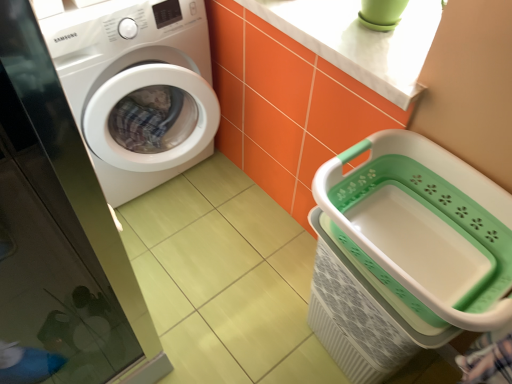
Locate an element on the screen. The height and width of the screenshot is (384, 512). white marble countertop at upper center is located at coordinates (359, 40).

Where is `white plastic laundry basket at lower right`? The width and height of the screenshot is (512, 384). white plastic laundry basket at lower right is located at coordinates (406, 253).

Where is `white marble countertop at upper center`? Image resolution: width=512 pixels, height=384 pixels. white marble countertop at upper center is located at coordinates (359, 40).

Can you confirm if transparent glass screen door at left is shorter than white glossy washing machine at left?

Yes.

How different are the orientations of transparent glass screen door at left and white glossy washing machine at left in degrees?

There is a 0.000107-degree angle between the facing directions of transparent glass screen door at left and white glossy washing machine at left.

How distant is transparent glass screen door at left from white glossy washing machine at left?

transparent glass screen door at left and white glossy washing machine at left are 32.79 centimeters apart.

From a real-world perspective, is transparent glass screen door at left located beneath white glossy washing machine at left?

No, from a real-world perspective, transparent glass screen door at left is not below white glossy washing machine at left.

Would you say transparent glass screen door at left is a long distance from white plastic laundry basket at lower right?

No.

Identify the location of shopping basket to the right of transparent glass screen door at left. (406, 253).

How different are the orientations of transparent glass screen door at left and white plastic laundry basket at lower right in degrees?

transparent glass screen door at left and white plastic laundry basket at lower right are facing 90 degrees away from each other.

Could you tell me if transparent glass screen door at left is turned towards white plastic laundry basket at lower right?

No, transparent glass screen door at left is not turned towards white plastic laundry basket at lower right.

How different are the orientations of transparent glass screen door at left and white marble countertop at upper center in degrees?

transparent glass screen door at left and white marble countertop at upper center are facing 89.1 degrees away from each other.

Is white marble countertop at upper center at the back of transparent glass screen door at left?

That's not correct — transparent glass screen door at left is not looking away from white marble countertop at upper center.

Does point (64, 196) come behind point (414, 90)?

Yes.

Considering the relative sizes of transparent glass screen door at left and white marble countertop at upper center in the image provided, is transparent glass screen door at left thinner than white marble countertop at upper center?

Indeed, transparent glass screen door at left has a lesser width compared to white marble countertop at upper center.

Looking at this image, which object is further away from the camera, white glossy washing machine at left or white plastic laundry basket at lower right?

Positioned behind is white glossy washing machine at left.

Which is nearer, (170, 25) or (333, 159)?

Positioned in front is point (333, 159).

Considering the sizes of objects white glossy washing machine at left and white plastic laundry basket at lower right in the image provided, who is thinner, white glossy washing machine at left or white plastic laundry basket at lower right?

With smaller width is white plastic laundry basket at lower right.

Is white marble countertop at upper center inside the boundaries of white glossy washing machine at left, or outside?

The correct answer is: outside.

Considering the relative sizes of white marble countertop at upper center and white glossy washing machine at left in the image provided, is white marble countertop at upper center thinner than white glossy washing machine at left?

Yes.

Considering their positions, is white marble countertop at upper center located in front of or behind white glossy washing machine at left?

Clearly, white marble countertop at upper center is in front of white glossy washing machine at left.

Considering the sizes of objects white plastic laundry basket at lower right and white glossy washing machine at left in the image provided, who is wider, white plastic laundry basket at lower right or white glossy washing machine at left?

white glossy washing machine at left.

Is white plastic laundry basket at lower right far away from white glossy washing machine at left?

That's not correct — white plastic laundry basket at lower right is a little close to white glossy washing machine at left.

This screenshot has height=384, width=512. I want to click on washing machine that appears below the white plastic laundry basket at lower right (from a real-world perspective), so click(136, 84).

Between white plastic laundry basket at lower right and white glossy washing machine at left, which one appears on the right side from the viewer's perspective?

white plastic laundry basket at lower right.

From the image's perspective, is white plastic laundry basket at lower right over white marble countertop at upper center?

No, from the image's perspective, white plastic laundry basket at lower right is not above white marble countertop at upper center.

Which point is more forward, (350, 319) or (346, 32)?

The point (350, 319) is closer.

Is white plastic laundry basket at lower right closer to the viewer compared to white marble countertop at upper center?

Yes, white plastic laundry basket at lower right is closer to the camera.

Which object is positioned more to the left, white plastic laundry basket at lower right or white marble countertop at upper center?

white marble countertop at upper center.

Find the location of a particular element. The image size is (512, 384). washing machine located behind the transparent glass screen door at left is located at coordinates (136, 84).

The image size is (512, 384). In order to click on shopping basket below the transparent glass screen door at left (from the image's perspective) in this screenshot , I will do `click(406, 253)`.

Looking at the image, which one is located further to white marble countertop at upper center, white glossy washing machine at left or white plastic laundry basket at lower right?

white glossy washing machine at left.

Considering their positions, is white marble countertop at upper center positioned further to transparent glass screen door at left than white glossy washing machine at left?

Based on the image, white marble countertop at upper center appears to be further to transparent glass screen door at left.

Considering their positions, is transparent glass screen door at left positioned closer to white marble countertop at upper center than white plastic laundry basket at lower right?

white plastic laundry basket at lower right is positioned closer to the anchor white marble countertop at upper center.

Which object lies nearer to the anchor point white plastic laundry basket at lower right, transparent glass screen door at left or white marble countertop at upper center?

white marble countertop at upper center lies closer to white plastic laundry basket at lower right than the other object.

Considering their positions, is white plastic laundry basket at lower right positioned further to white glossy washing machine at left than transparent glass screen door at left?

white plastic laundry basket at lower right lies further to white glossy washing machine at left than the other object.

Estimate the real-world distances between objects in this image. Which object is further from white marble countertop at upper center, white plastic laundry basket at lower right or transparent glass screen door at left?

Among the two, transparent glass screen door at left is located further to white marble countertop at upper center.

From the image, which object appears to be farther from white marble countertop at upper center, white glossy washing machine at left or transparent glass screen door at left?

The object further to white marble countertop at upper center is transparent glass screen door at left.

Based on their spatial positions, is transparent glass screen door at left or white plastic laundry basket at lower right closer to white glossy washing machine at left?

The object closer to white glossy washing machine at left is transparent glass screen door at left.

The width and height of the screenshot is (512, 384). Find the location of `screen door between white glossy washing machine at left and white marble countertop at upper center`. screen door between white glossy washing machine at left and white marble countertop at upper center is located at coordinates (59, 237).

This screenshot has width=512, height=384. In order to click on counter top between transparent glass screen door at left and white plastic laundry basket at lower right in the horizontal direction in this screenshot , I will do `click(359, 40)`.

This screenshot has width=512, height=384. Identify the location of screen door between white glossy washing machine at left and white plastic laundry basket at lower right from left to right. (59, 237).

Identify the location of counter top located between white glossy washing machine at left and white plastic laundry basket at lower right in the left-right direction. (359, 40).